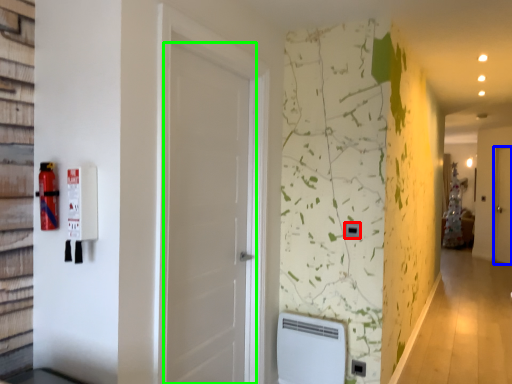
Question: Estimate the real-world distances between objects in this image. Which object is closer to light switch (highlighted by a red box), door (highlighted by a blue box) or door (highlighted by a green box)?

Choices:
 (A) door
 (B) door

Answer: (B)